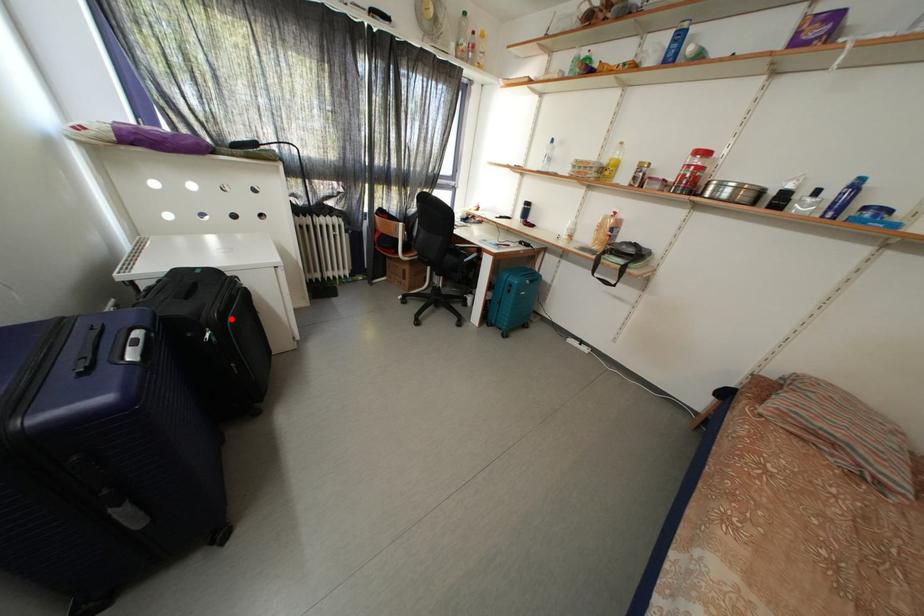
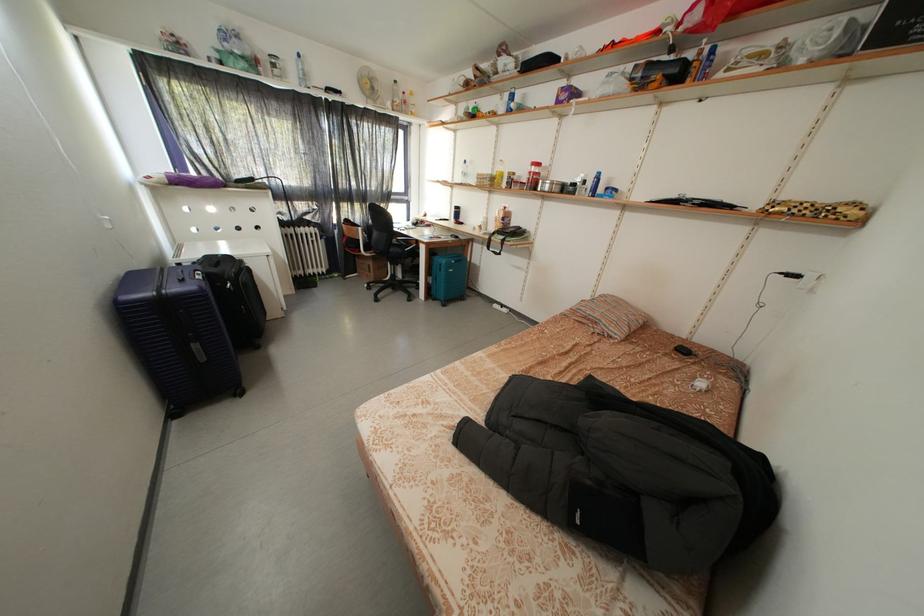
The point at the highlighted location is marked in the first image. Where is the corresponding point in the second image?

(246, 280)